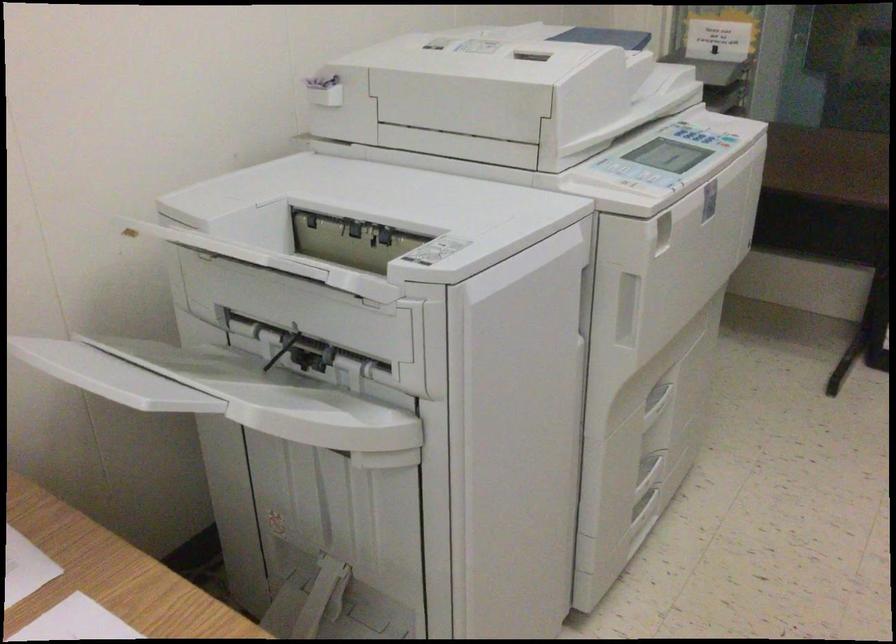
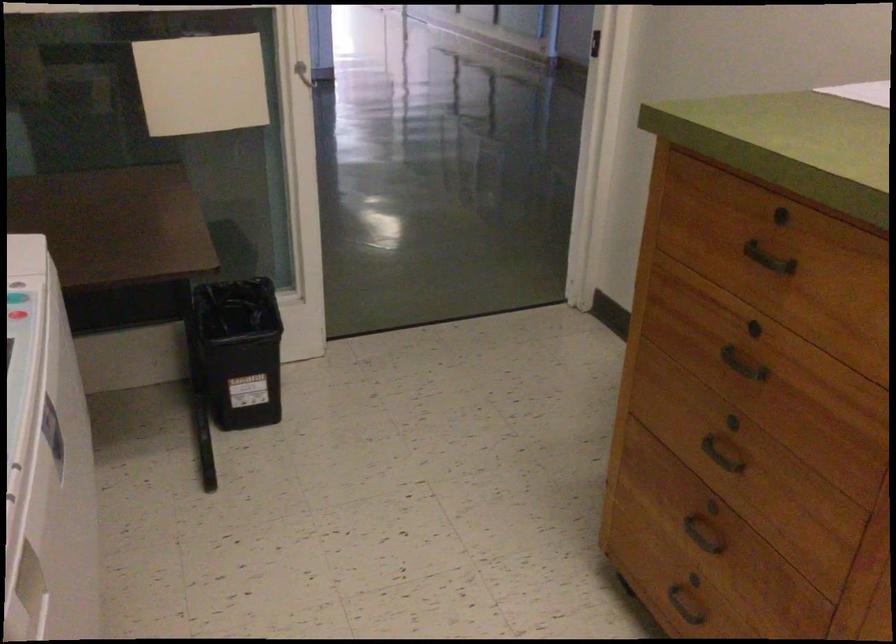
Question: The images are taken continuously from a first-person perspective. In which direction is your viewpoint rotating?

Choices:
 (A) Left
 (B) Right
 (C) Up
 (D) Down

Answer: (B)